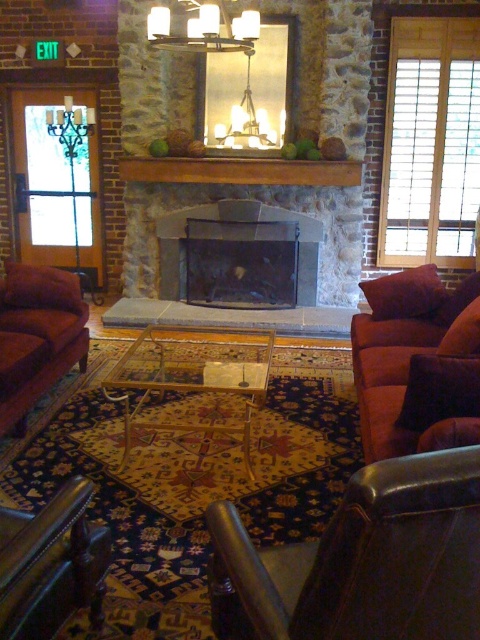
Question: Which point is closer to the camera?

Choices:
 (A) matte white fixture at upper center
 (B) clear glass coffee table at center
 (C) velvet brown couch at right
 (D) leather armchair at lower left

Answer: (D)

Question: Does leather at lower right appear on the left side of leather armchair at lower left?

Choices:
 (A) yes
 (B) no

Answer: (B)

Question: Is clear glass coffee table at center above dark gray stone fireplace at center?

Choices:
 (A) yes
 (B) no

Answer: (B)

Question: Which of these objects is positioned closest to the matte white fixture at upper center?

Choices:
 (A) leather at lower right
 (B) velvet maroon couch at left

Answer: (B)

Question: Which point is farther to the camera?

Choices:
 (A) dark gray stone fireplace at center
 (B) velvet brown couch at right
 (C) matte white fixture at upper center
 (D) leather at lower right

Answer: (A)

Question: Is leather at lower right to the left of velvet brown couch at right from the viewer's perspective?

Choices:
 (A) yes
 (B) no

Answer: (A)